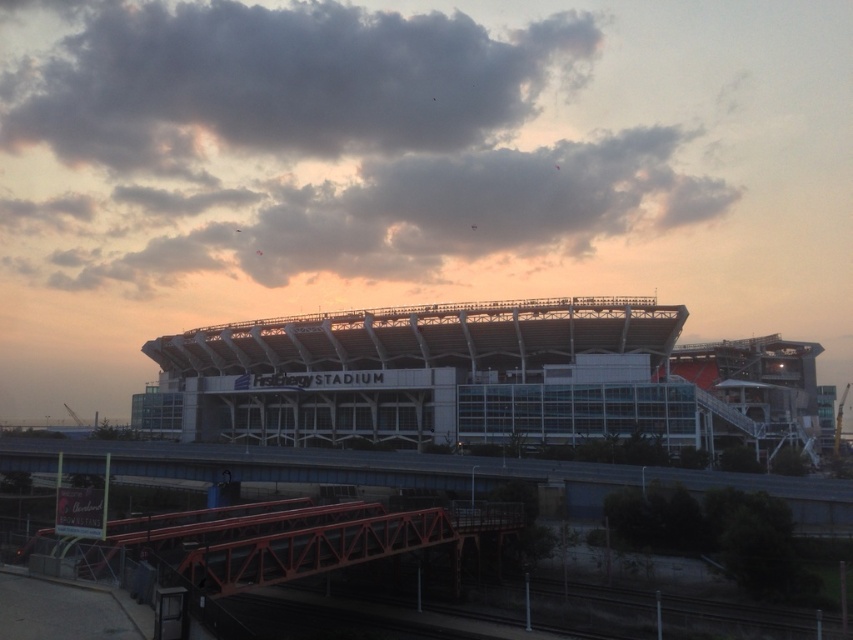
Question: Can you confirm if white glass stadium at center is positioned below dark gray cloud at upper center?

Choices:
 (A) yes
 (B) no

Answer: (A)

Question: Can you confirm if white glass stadium at center is positioned below dark gray cloud at upper center?

Choices:
 (A) yes
 (B) no

Answer: (A)

Question: Which point is closer to the camera?

Choices:
 (A) (334, 209)
 (B) (366, 336)
 (C) (410, 52)

Answer: (B)

Question: In this image, where is white glass stadium at center located relative to dark gray cloud at upper center?

Choices:
 (A) left
 (B) right

Answer: (B)

Question: Which of the following is the farthest from the observer?

Choices:
 (A) white glass stadium at center
 (B) cloudy sky at upper center

Answer: (B)

Question: Among these objects, which one is nearest to the camera?

Choices:
 (A) dark gray cloud at upper center
 (B) white glass stadium at center
 (C) cloudy sky at upper center

Answer: (B)